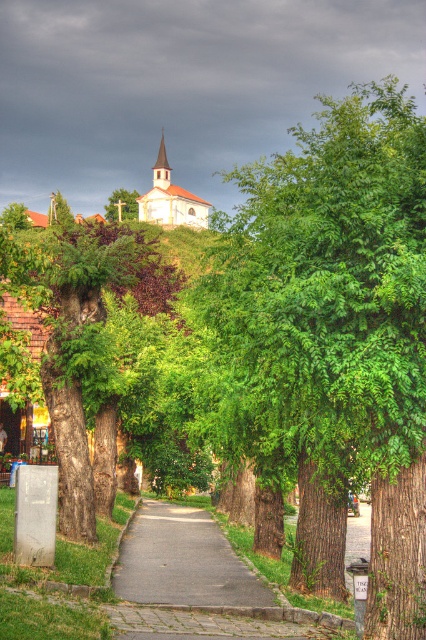
Question: Can you confirm if gray asphalt path at center is wider than green leafy tree at upper center?

Choices:
 (A) no
 (B) yes

Answer: (A)

Question: Is gray asphalt path at center positioned at the back of green leafy tree at upper center?

Choices:
 (A) no
 (B) yes

Answer: (A)

Question: Can you confirm if smooth brown tree trunk at center is smaller than gray asphalt path at center?

Choices:
 (A) no
 (B) yes

Answer: (A)

Question: Which point is farther from the camera taking this photo?

Choices:
 (A) (204, 216)
 (B) (127, 244)

Answer: (A)

Question: Which point is farther to the camera?

Choices:
 (A) (284, 387)
 (B) (221, 536)

Answer: (B)

Question: Which point is farther to the camera?

Choices:
 (A) 184,600
 (B) 397,273

Answer: (A)